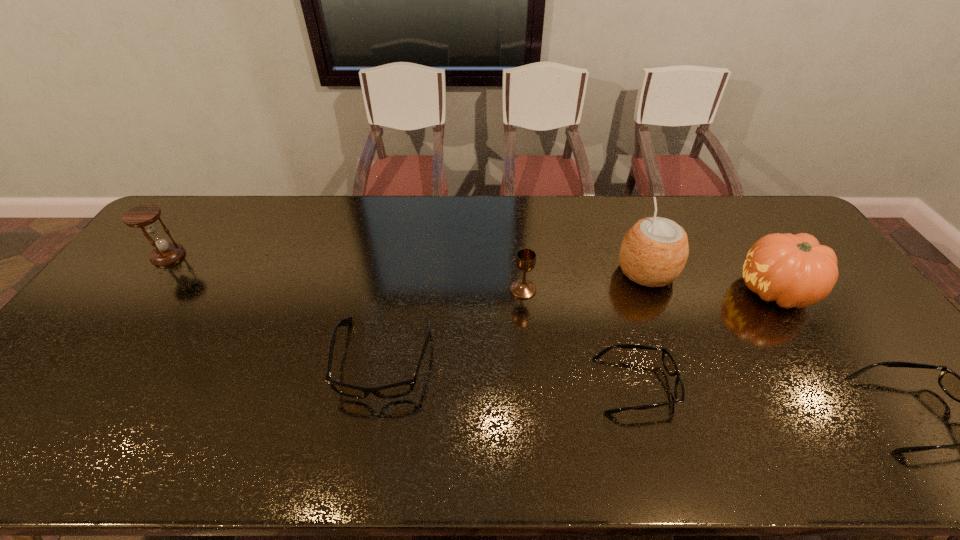
In the image, there is a desktop. Identify the location of vacant region at the right edge. The width and height of the screenshot is (960, 540). (857, 355).

What are the coordinates of `vacant space at the far right corner of the desktop` in the screenshot? It's located at (793, 228).

The height and width of the screenshot is (540, 960). I want to click on free point between the leftmost object and the pumpkin, so click(x=472, y=273).

I want to click on vacant space that's between the shortest object and the chalice, so click(580, 337).

Identify the location of empty location between the chalice and the shortest object. (580, 337).

This screenshot has height=540, width=960. Find the location of `vacant area that lies between the pumpkin and the chalice`. vacant area that lies between the pumpkin and the chalice is located at coordinates (649, 291).

Locate an element on the screen. The image size is (960, 540). free space between the chalice and the pumpkin is located at coordinates (649, 291).

Locate an element on the screen. vacant area between the coconut and the pumpkin is located at coordinates pos(711,281).

You are a GUI agent. You are given a task and a screenshot of the screen. Output one action in this format:
    pyautogui.click(x=<x>, y=<y>)
    Task: Click on the object that can be found as the fourth closest to the leftmost object
    This screenshot has height=540, width=960.
    Given the screenshot: What is the action you would take?
    pyautogui.click(x=653, y=253)

Identify which object is located as the sixth nearest to the sixth tallest object. Please provide its 2D coordinates. Your answer should be formatted as a tuple, i.e. [(x, y)], where the tuple contains the x and y coordinates of a point satisfying the conditions above.

[(144, 216)]